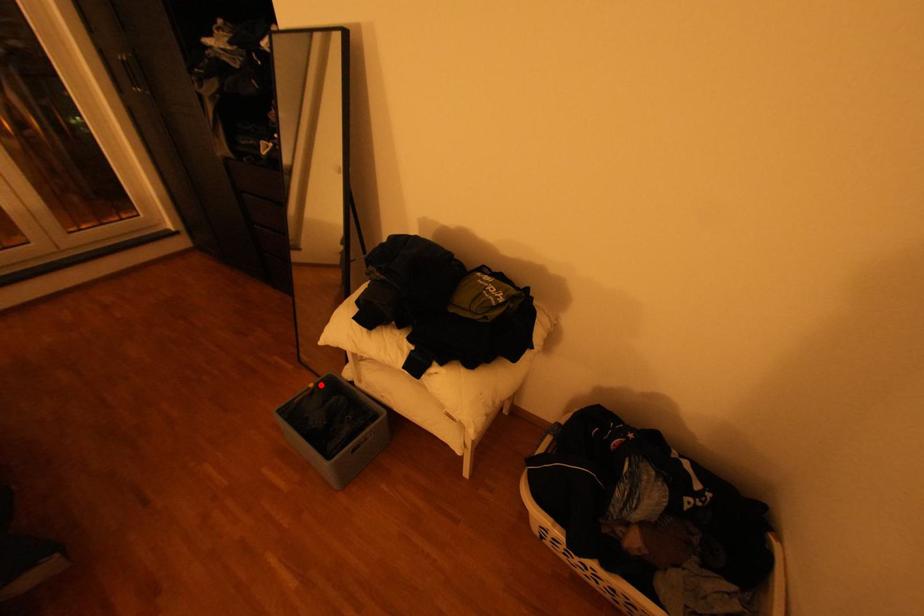
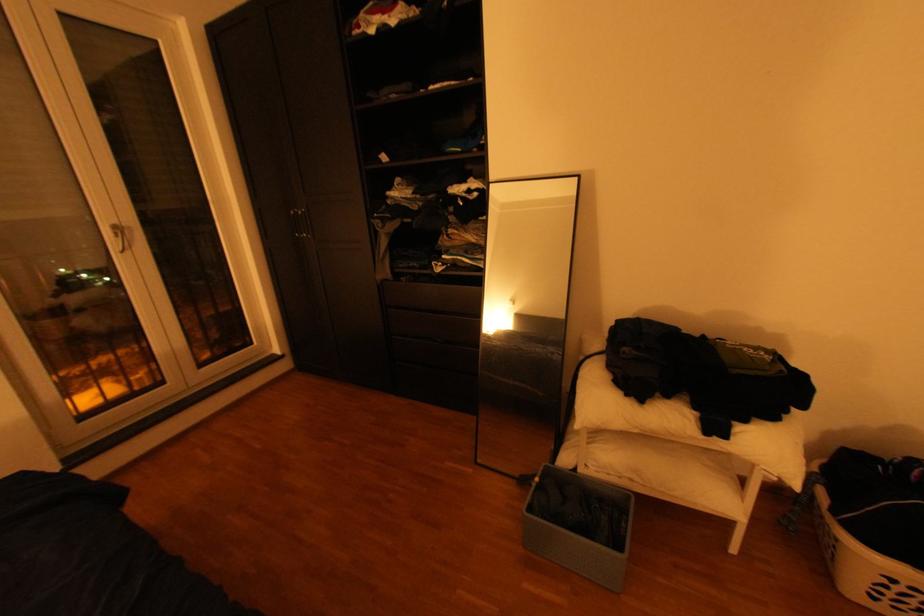
The point at the highlighted location is marked in the first image. Where is the corresponding point in the second image?

(545, 480)